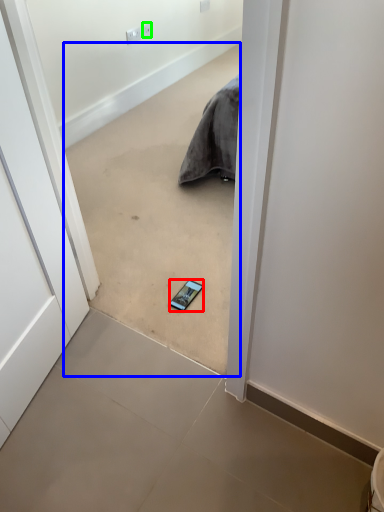
Question: Estimate the real-world distances between objects in this image. Which object is farther from smartphone (highlighted by a red box), concrete (highlighted by a blue box) or electric outlet (highlighted by a green box)?

Choices:
 (A) concrete
 (B) electric outlet

Answer: (B)